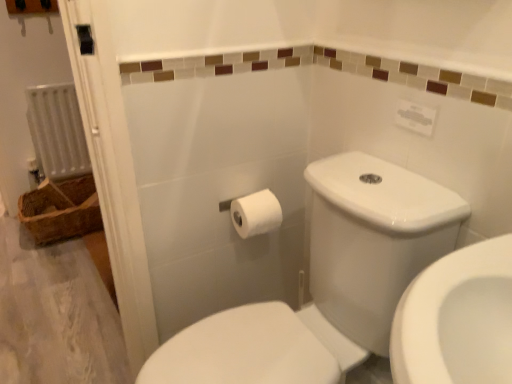
Find the location of a particular element. The width and height of the screenshot is (512, 384). woven brown basket at left is located at coordinates pyautogui.click(x=61, y=210).

The width and height of the screenshot is (512, 384). Describe the element at coordinates (256, 214) in the screenshot. I see `white matte toilet paper at center` at that location.

This screenshot has width=512, height=384. I want to click on woven brown basket at left, so click(61, 210).

Which object is closer to the camera, woven brown basket at left or white plastic radiator at left?

woven brown basket at left is closer to the camera.

Does point (89, 216) come farther from viewer compared to point (35, 115)?

No, it is in front of (35, 115).

Can you tell me how much woven brown basket at left and white plastic radiator at left differ in facing direction?

The angular difference between woven brown basket at left and white plastic radiator at left is 2.74 degrees.

From a real-world perspective, which object stands above the other?

From a 3D spatial view, white plastic radiator at left is above.

Find the location of a particular element. The image size is (512, 384). toilet that is below the white plastic radiator at left (from the image's perspective) is located at coordinates (327, 283).

Does white plastic radiator at left contain white glossy toilet at center?

That's incorrect, white glossy toilet at center is not inside white plastic radiator at left.

From a real-world perspective, which object rests below the other?

From a 3D spatial view, white glossy toilet at center is below.

Which is in front, point (31, 89) or point (227, 352)?

The point (227, 352) is in front.

Find the location of `basket below the white matte toilet paper at center (from the image's perspective)`. basket below the white matte toilet paper at center (from the image's perspective) is located at coordinates (61, 210).

In the image, is woven brown basket at left on the left side or the right side of white matte toilet paper at center?

woven brown basket at left is positioned on white matte toilet paper at center's left side.

Is woven brown basket at left thinner than white matte toilet paper at center?

Incorrect, the width of woven brown basket at left is not less than that of white matte toilet paper at center.

Which object is further away from the camera taking this photo, white plastic radiator at left or woven brown basket at left?

white plastic radiator at left is more distant.

Is white plastic radiator at left not within woven brown basket at left?

Yes, white plastic radiator at left is located beyond the bounds of woven brown basket at left.

Which is more to the left, white plastic radiator at left or woven brown basket at left?

white plastic radiator at left.

Can white matte toilet paper at center be found inside white plastic radiator at left?

No, white matte toilet paper at center is not surrounded by white plastic radiator at left.

Can you confirm if white plastic radiator at left is wider than white matte toilet paper at center?

No, white plastic radiator at left is not wider than white matte toilet paper at center.

Can you tell me how much white plastic radiator at left and white matte toilet paper at center differ in facing direction?

They differ by 0.183 degrees in their facing directions.

Which of these two, white plastic radiator at left or white matte toilet paper at center, is smaller?

white matte toilet paper at center is smaller.

Considering the sizes of white glossy toilet at center and white matte toilet paper at center in the image, is white glossy toilet at center wider or thinner than white matte toilet paper at center?

Clearly, white glossy toilet at center has more width compared to white matte toilet paper at center.

Is the position of white glossy toilet at center less distant than that of white matte toilet paper at center?

That is True.

How far apart are white glossy toilet at center and white matte toilet paper at center?

white glossy toilet at center is 11.17 inches from white matte toilet paper at center.

Is white glossy toilet at center looking in the opposite direction of white matte toilet paper at center?

That's not correct — white glossy toilet at center is not looking away from white matte toilet paper at center.

Is white matte toilet paper at center next to white plastic radiator at left and touching it?

white matte toilet paper at center is not next to white plastic radiator at left, and they're not touching.

Considering the sizes of objects white matte toilet paper at center and white plastic radiator at left in the image provided, who is smaller, white matte toilet paper at center or white plastic radiator at left?

white matte toilet paper at center is smaller.

Is white matte toilet paper at center turned away from white plastic radiator at left?

Yes, white plastic radiator at left is at the back of white matte toilet paper at center.

Looking at this image, considering the positions of objects white matte toilet paper at center and white plastic radiator at left in the image provided, who is more to the left, white matte toilet paper at center or white plastic radiator at left?

white plastic radiator at left.

You are a GUI agent. You are given a task and a screenshot of the screen. Output one action in this format:
    pyautogui.click(x=<x>, y=<y>)
    Task: Click on the radiator located behind the woven brown basket at left
    
    Given the screenshot: What is the action you would take?
    pyautogui.click(x=57, y=131)

Find the location of a particular element. toilet below the white plastic radiator at left (from a real-world perspective) is located at coordinates (327, 283).

Based on their spatial positions, is woven brown basket at left or white glossy toilet at center closer to white plastic radiator at left?

woven brown basket at left is positioned closer to the anchor white plastic radiator at left.

From the image, which object appears to be farther from white glossy toilet at center, white matte toilet paper at center or woven brown basket at left?

woven brown basket at left is further to white glossy toilet at center.

When comparing their distances from woven brown basket at left, does white matte toilet paper at center or white plastic radiator at left seem closer?

white plastic radiator at left is positioned closer to the anchor woven brown basket at left.

Which object lies nearer to the anchor point white plastic radiator at left, woven brown basket at left or white matte toilet paper at center?

woven brown basket at left lies closer to white plastic radiator at left than the other object.

Based on their spatial positions, is white glossy toilet at center or white matte toilet paper at center closer to woven brown basket at left?

The object closer to woven brown basket at left is white matte toilet paper at center.

From the image, which object appears to be nearer to woven brown basket at left, white plastic radiator at left or white matte toilet paper at center?

Among the two, white plastic radiator at left is located nearer to woven brown basket at left.

Based on their spatial positions, is woven brown basket at left or white glossy toilet at center closer to white matte toilet paper at center?

white glossy toilet at center lies closer to white matte toilet paper at center than the other object.

Estimate the real-world distances between objects in this image. Which object is closer to white matte toilet paper at center, white glossy toilet at center or white plastic radiator at left?

white glossy toilet at center.

The height and width of the screenshot is (384, 512). I want to click on toilet paper between white glossy toilet at center and white plastic radiator at left in the front-back direction, so click(x=256, y=214).

Where is `basket between white plastic radiator at left and white matte toilet paper at center`? The width and height of the screenshot is (512, 384). basket between white plastic radiator at left and white matte toilet paper at center is located at coordinates (61, 210).

This screenshot has width=512, height=384. Find the location of `basket between white glossy toilet at center and white plastic radiator at left along the z-axis`. basket between white glossy toilet at center and white plastic radiator at left along the z-axis is located at coordinates (61, 210).

Find the location of `toilet paper positioned between white glossy toilet at center and woven brown basket at left from near to far`. toilet paper positioned between white glossy toilet at center and woven brown basket at left from near to far is located at coordinates (256, 214).